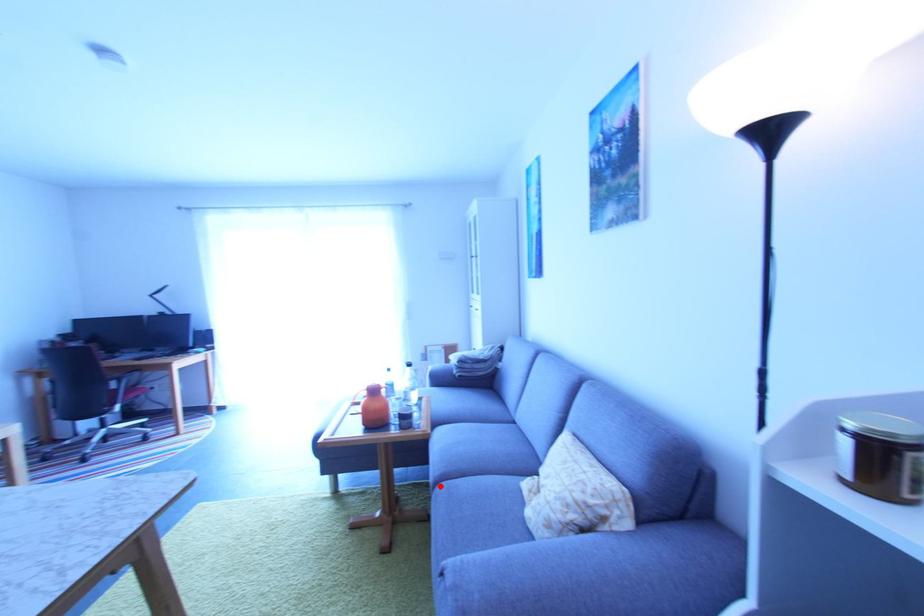
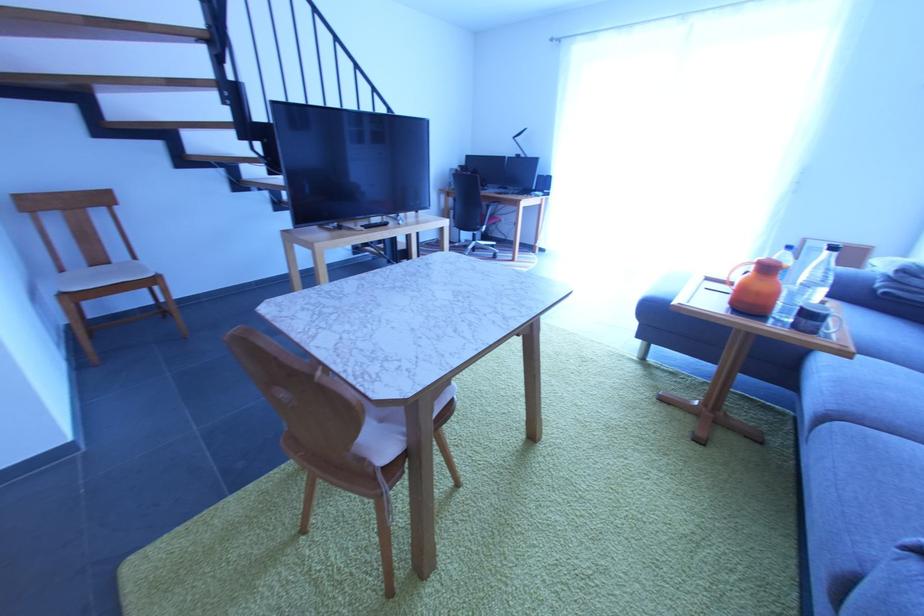
The point at the highlighted location is marked in the first image. Where is the corresponding point in the second image?

(833, 419)